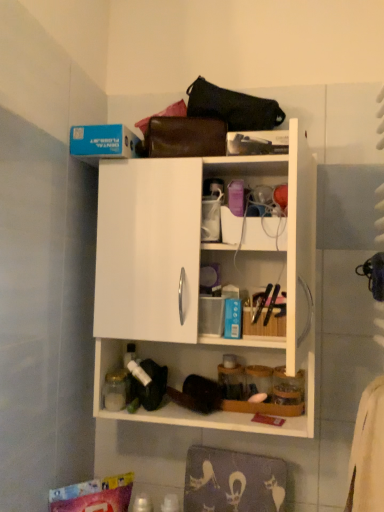
Question: Is white matte cabinet at upper center shorter than leather handbag at upper center, acting as the second handbag starting from the top?

Choices:
 (A) no
 (B) yes

Answer: (A)

Question: From the image's perspective, is white matte cabinet at upper center under leather handbag at upper center, acting as the second handbag starting from the top?

Choices:
 (A) yes
 (B) no

Answer: (A)

Question: From a real-world perspective, is white matte cabinet at upper center on leather handbag at upper center, acting as the first handbag starting from the bottom?

Choices:
 (A) yes
 (B) no

Answer: (B)

Question: Does white matte cabinet at upper center lie behind leather handbag at upper center, acting as the first handbag starting from the bottom?

Choices:
 (A) no
 (B) yes

Answer: (A)

Question: From a real-world perspective, is white matte cabinet at upper center below leather handbag at upper center, acting as the first handbag starting from the bottom?

Choices:
 (A) no
 (B) yes

Answer: (B)

Question: Does white matte cabinet at upper center have a lesser width compared to leather handbag at upper center, acting as the second handbag starting from the top?

Choices:
 (A) yes
 (B) no

Answer: (B)

Question: Is black leather handbag at upper center, the first handbag from the top, thinner than leather handbag at upper center, acting as the second handbag starting from the top?

Choices:
 (A) yes
 (B) no

Answer: (B)

Question: Would you consider black leather handbag at upper center, which is the second handbag in bottom-to-top order, to be distant from leather handbag at upper center, acting as the second handbag starting from the top?

Choices:
 (A) yes
 (B) no

Answer: (B)

Question: Can you confirm if black leather handbag at upper center, the first handbag from the top, is positioned to the right of leather handbag at upper center, acting as the first handbag starting from the bottom?

Choices:
 (A) yes
 (B) no

Answer: (A)

Question: Considering the relative sizes of black leather handbag at upper center, the first handbag from the top, and leather handbag at upper center, acting as the first handbag starting from the bottom, in the image provided, is black leather handbag at upper center, the first handbag from the top, smaller than leather handbag at upper center, acting as the first handbag starting from the bottom,?

Choices:
 (A) yes
 (B) no

Answer: (B)

Question: Is black leather handbag at upper center, which is the second handbag in bottom-to-top order, directly adjacent to leather handbag at upper center, acting as the second handbag starting from the top?

Choices:
 (A) yes
 (B) no

Answer: (A)

Question: From a real-world perspective, is black leather handbag at upper center, which is the second handbag in bottom-to-top order, on top of leather handbag at upper center, acting as the second handbag starting from the top?

Choices:
 (A) yes
 (B) no

Answer: (A)

Question: Is black leather handbag at upper center, the first handbag from the top, looking in the opposite direction of white matte cabinet at upper center?

Choices:
 (A) no
 (B) yes

Answer: (A)